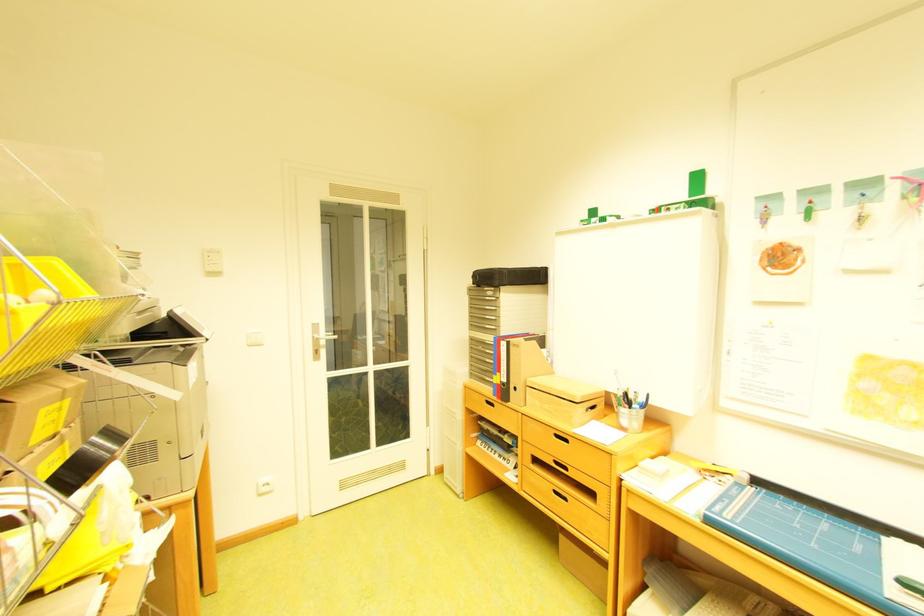
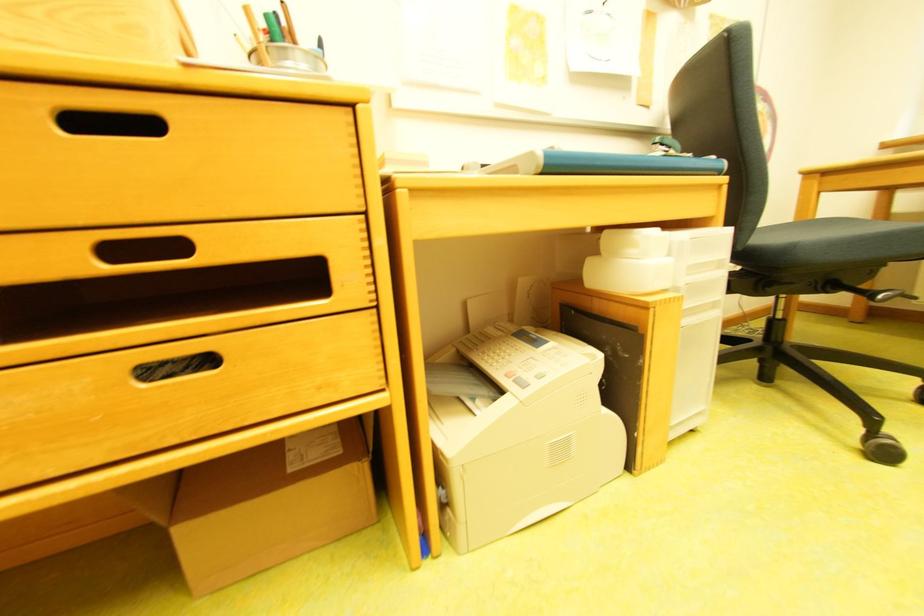
Locate, in the second image, the point that corresponds to point 570,560 in the first image.

(201, 592)